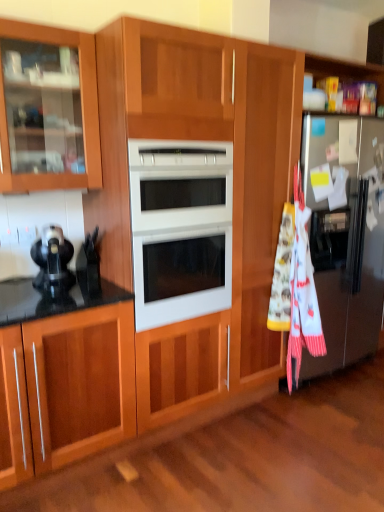
Question: Is point (292, 254) positioned closer to the camera than point (344, 286)?

Choices:
 (A) closer
 (B) farther

Answer: (A)

Question: Considering the positions of white cotton beach towel at right and silver metallic refrigerator at right in the image, is white cotton beach towel at right bigger or smaller than silver metallic refrigerator at right?

Choices:
 (A) big
 (B) small

Answer: (B)

Question: Which is nearer to the white cotton beach towel at right?

Choices:
 (A) matte black coffee maker at left
 (B) white glossy microwave oven at center
 (C) silver metallic refrigerator at right

Answer: (C)

Question: Estimate the real-world distances between objects in this image. Which object is farther from the silver metallic refrigerator at right?

Choices:
 (A) matte black coffee maker at left
 (B) white cotton beach towel at right
 (C) white glossy microwave oven at center

Answer: (A)